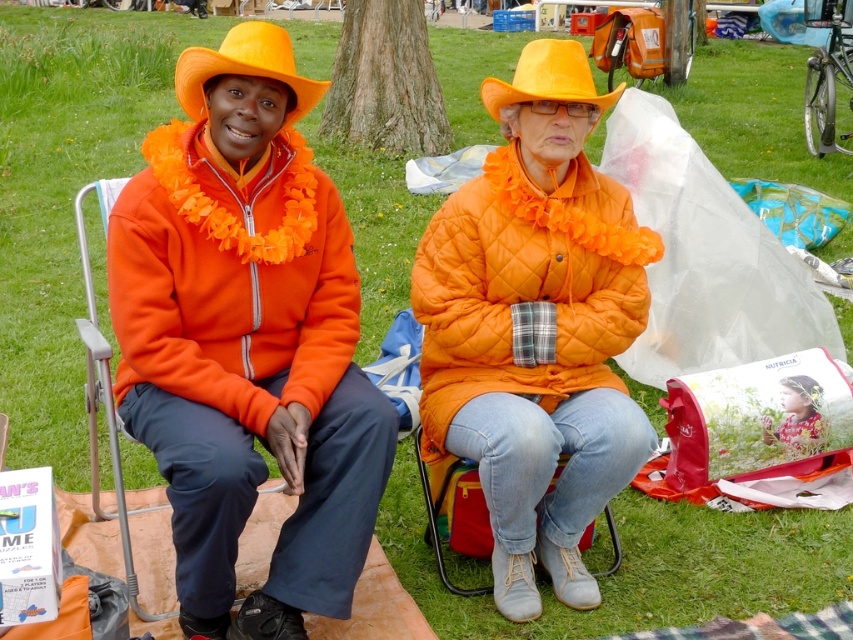
Question: Does orange fabric folding chair at left have a larger size compared to orange matte hat at center?

Choices:
 (A) yes
 (B) no

Answer: (A)

Question: Which point appears farthest from the camera in this image?

Choices:
 (A) (526, 93)
 (B) (144, 620)

Answer: (B)

Question: Which of the following is the farthest from the observer?

Choices:
 (A) orange matte hat at center
 (B) floral fabric at center

Answer: (B)

Question: Can you confirm if orange matte hat at left is thinner than floral fabric at center?

Choices:
 (A) yes
 (B) no

Answer: (B)

Question: Is orange matte hat at left thinner than orange matte hat at center?

Choices:
 (A) no
 (B) yes

Answer: (A)

Question: Which of the following is the farthest from the observer?

Choices:
 (A) (163, 612)
 (B) (527, 413)
 (C) (553, 86)

Answer: (A)